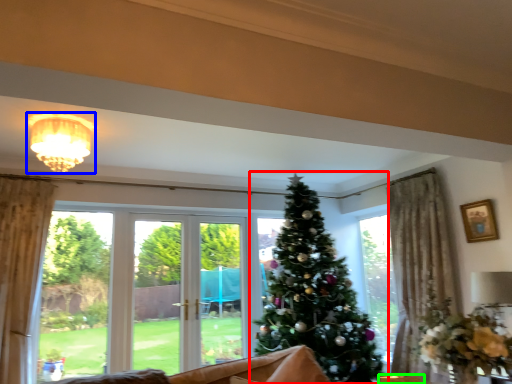
Question: Which object is the farthest from christmas tree (highlighted by a red box)? Choose among these: light fixture (highlighted by a blue box) or furniture (highlighted by a green box).

Choices:
 (A) light fixture
 (B) furniture

Answer: (A)